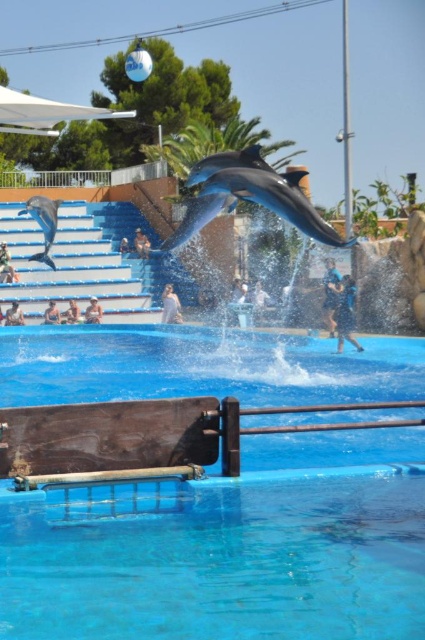
You are a marine biologist observing the dolphin show. You notice the blue smooth water at center and the blue fabric trainer at center. Which object is positioned lower in the image?

The blue smooth water at center is located below the blue fabric trainer at center, so it is positioned lower in the image.

You are a visitor at the marine park and want to take a photo of both the blue smooth water at center and the blue fabric trainer at center. Which object should you focus on first if you want to capture them from left to right in your camera view?

You should focus on the blue smooth water at center first because it is positioned to the left of the blue fabric trainer at center, so capturing them from left to right would start with the blue smooth water at center.